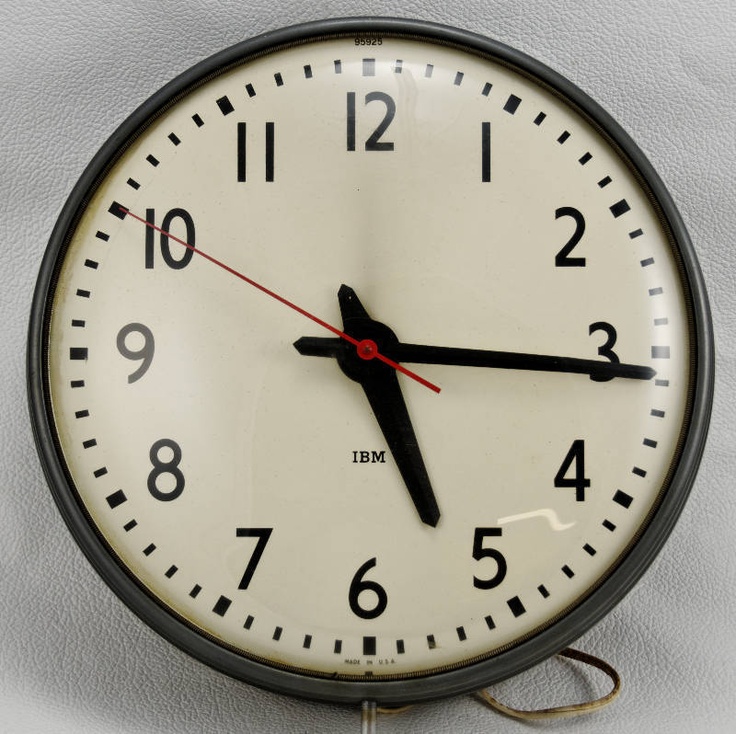
Image resolution: width=736 pixels, height=734 pixels. I want to click on cord, so click(x=556, y=712).